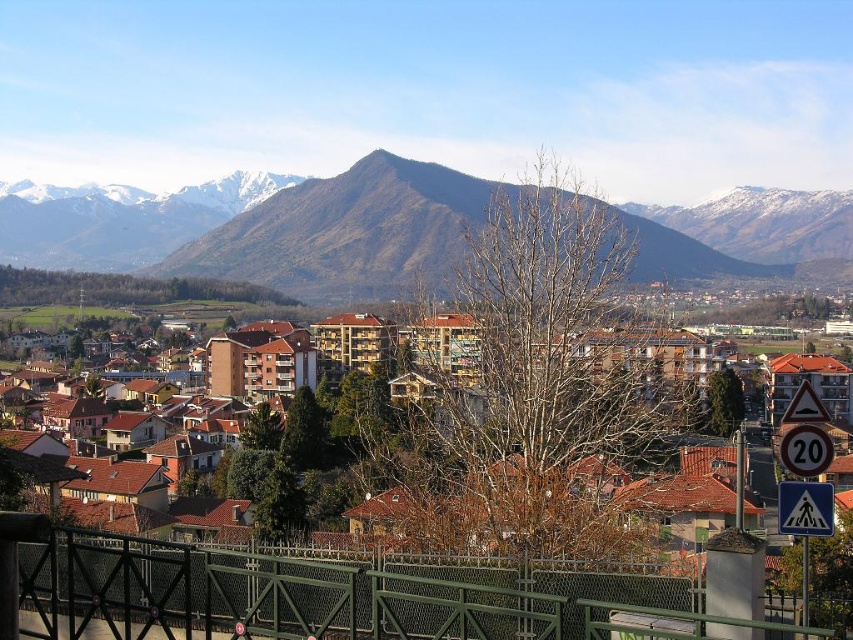
Question: Where is brown tiled roofs at center located in relation to white plastic pedestrian crossing sign at lower right in the image?

Choices:
 (A) left
 (B) right

Answer: (A)

Question: Among these objects, which one is farthest from the camera?

Choices:
 (A) white plastic pedestrian crossing sign at lower right
 (B) brown tiled roofs at center

Answer: (A)

Question: Is brown tiled roofs at center positioned in front of white plastic speed limit sign at right?

Choices:
 (A) yes
 (B) no

Answer: (B)

Question: Which point is closer to the camera?

Choices:
 (A) snow-covered mountain range at center
 (B) white plastic pedestrian crossing sign at lower right
 (C) white plastic speed limit sign at right
 (D) brown tiled roofs at center

Answer: (C)

Question: Is snow-covered mountain range at center in front of white plastic speed limit sign at right?

Choices:
 (A) no
 (B) yes

Answer: (A)

Question: Which point is farther from the camera taking this photo?

Choices:
 (A) (814, 502)
 (B) (386, 209)

Answer: (B)